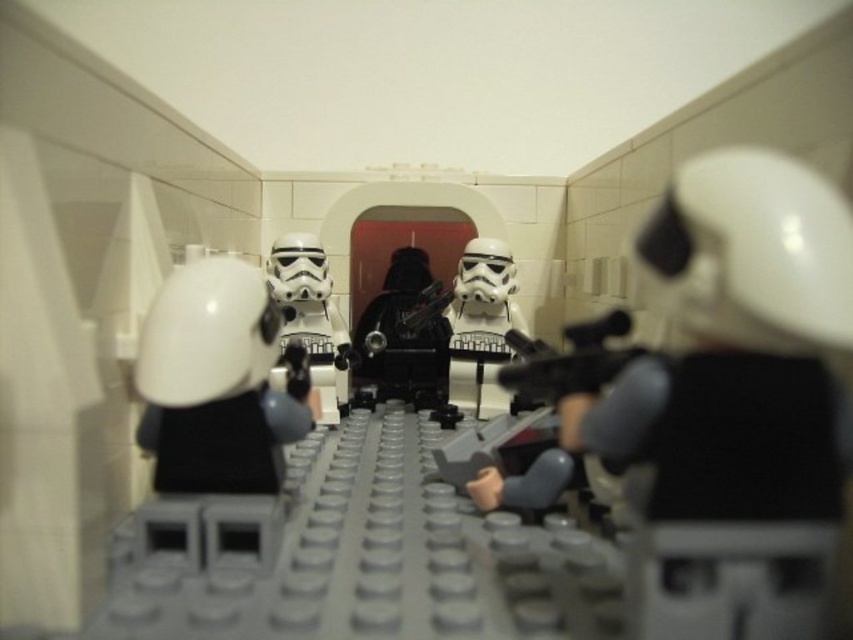
Question: Which point appears closest to the camera in this image?

Choices:
 (A) pos(463,316)
 (B) pos(326,272)

Answer: (B)

Question: Is white glossy helmet at center in front of black plastic gun at center?

Choices:
 (A) yes
 (B) no

Answer: (A)

Question: Which point appears farthest from the camera in this image?

Choices:
 (A) (677, 179)
 (B) (233, 422)
 (C) (590, 388)

Answer: (A)

Question: Based on their relative distances, which object is farther from the black plastic gun at center?

Choices:
 (A) white glossy helmet at center
 (B) white matte helmet at center

Answer: (A)

Question: Is black plastic gun at center positioned behind matte black gun at center?

Choices:
 (A) yes
 (B) no

Answer: (A)

Question: Can you confirm if black plastic gun at center is thinner than metallic silver gun at center?

Choices:
 (A) no
 (B) yes

Answer: (A)